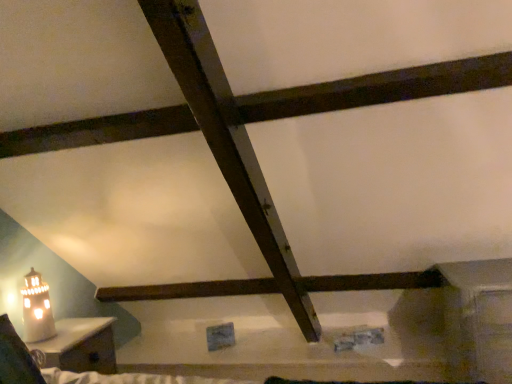
Question: Does matte wooden nightstand at lower left come in front of white ceramic table lamp at lower left?

Choices:
 (A) yes
 (B) no

Answer: (A)

Question: Is matte wooden nightstand at lower left smaller than white ceramic table lamp at lower left?

Choices:
 (A) no
 (B) yes

Answer: (A)

Question: Does matte wooden nightstand at lower left have a larger size compared to white ceramic table lamp at lower left?

Choices:
 (A) yes
 (B) no

Answer: (A)

Question: Considering the relative sizes of matte wooden nightstand at lower left and white ceramic table lamp at lower left in the image provided, is matte wooden nightstand at lower left thinner than white ceramic table lamp at lower left?

Choices:
 (A) no
 (B) yes

Answer: (A)

Question: Is matte wooden nightstand at lower left positioned beyond the bounds of white ceramic table lamp at lower left?

Choices:
 (A) yes
 (B) no

Answer: (A)

Question: Is matte wooden nightstand at lower left behind white ceramic table lamp at lower left?

Choices:
 (A) yes
 (B) no

Answer: (B)

Question: Is white ceramic table lamp at lower left positioned beyond the bounds of matte wooden nightstand at lower left?

Choices:
 (A) yes
 (B) no

Answer: (A)

Question: From the image's perspective, would you say white ceramic table lamp at lower left is positioned over matte wooden nightstand at lower left?

Choices:
 (A) yes
 (B) no

Answer: (A)

Question: Does white ceramic table lamp at lower left turn towards matte wooden nightstand at lower left?

Choices:
 (A) yes
 (B) no

Answer: (B)

Question: Considering the relative sizes of white ceramic table lamp at lower left and matte wooden nightstand at lower left in the image provided, is white ceramic table lamp at lower left bigger than matte wooden nightstand at lower left?

Choices:
 (A) no
 (B) yes

Answer: (A)

Question: Are white ceramic table lamp at lower left and matte wooden nightstand at lower left beside each other?

Choices:
 (A) no
 (B) yes

Answer: (A)

Question: Does white ceramic table lamp at lower left have a lesser width compared to matte wooden nightstand at lower left?

Choices:
 (A) yes
 (B) no

Answer: (A)

Question: Relative to white ceramic table lamp at lower left, is matte wooden nightstand at lower left in front or behind?

Choices:
 (A) behind
 (B) front

Answer: (B)